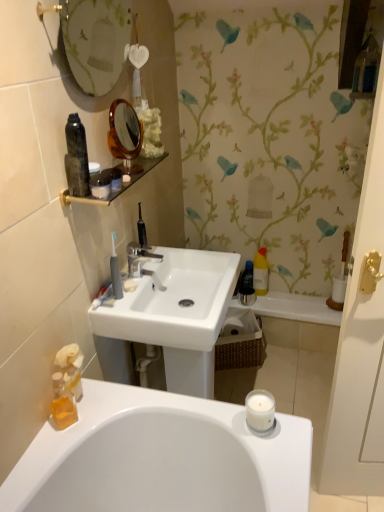
Find the location of `free space above woven brown picnic basket at lower center (from a real-world perspective)`. free space above woven brown picnic basket at lower center (from a real-world perspective) is located at coordinates (236, 316).